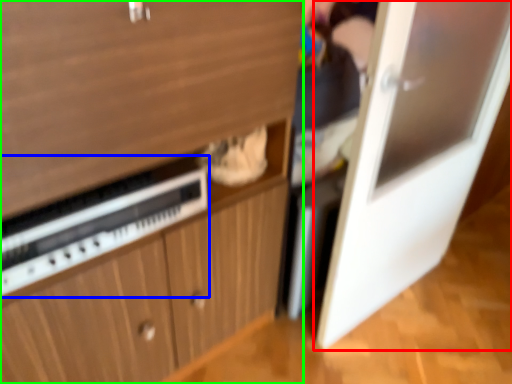
Question: Which is nearer to the door (highlighted by a red box)? appliance (highlighted by a blue box) or cabinetry (highlighted by a green box).

Choices:
 (A) appliance
 (B) cabinetry

Answer: (B)